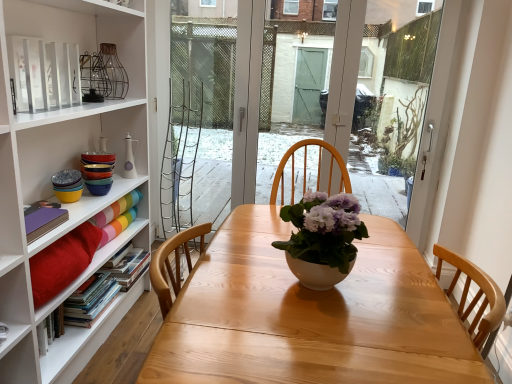
You are a GUI agent. You are given a task and a screenshot of the screen. Output one action in this format:
    pyautogui.click(x=<x>, y=<y>)
    Task: Click on the blank space situated above purple matte book at left, the second book positioned from the top (from a real-world perspective)
    
    Given the screenshot: What is the action you would take?
    pyautogui.click(x=35, y=220)